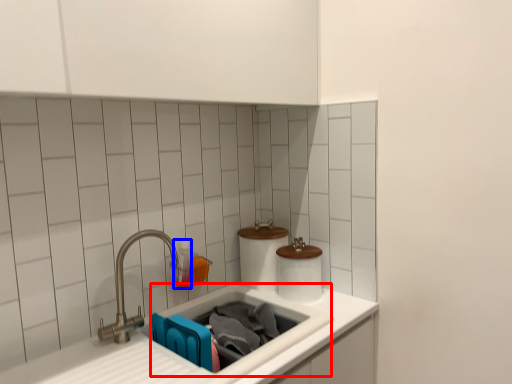
Question: Which object is closer to the camera taking this photo, sink (highlighted by a red box) or toiletry (highlighted by a blue box)?

Choices:
 (A) sink
 (B) toiletry

Answer: (A)